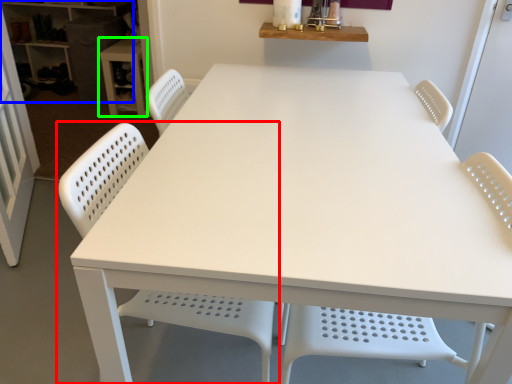
Question: Based on their relative distances, which object is farther from chair (highlighted by a red box)? Choose from shelf (highlighted by a blue box) and table (highlighted by a green box).

Choices:
 (A) shelf
 (B) table

Answer: (A)